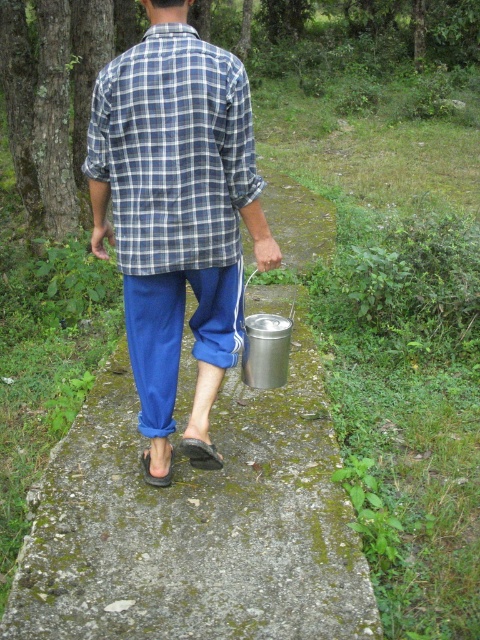
Based on the scene description, which object is positioned higher up in the image between the blue cotton pants at lower center and the blue plaid shirt at center?

The blue cotton pants at lower center is taller than the blue plaid shirt at center, so the blue cotton pants at lower center is positioned higher up in the image.

You are standing at the camera position and want to approach the person wearing blue cotton pants at lower center. If your walking speed is 1.1 meters per second, how many seconds will it take you to reach them?

The distance between you and the blue cotton pants at lower center is 2.20 meters. At a walking speed of 1.1 meters per second, it will take 2 seconds to reach them.